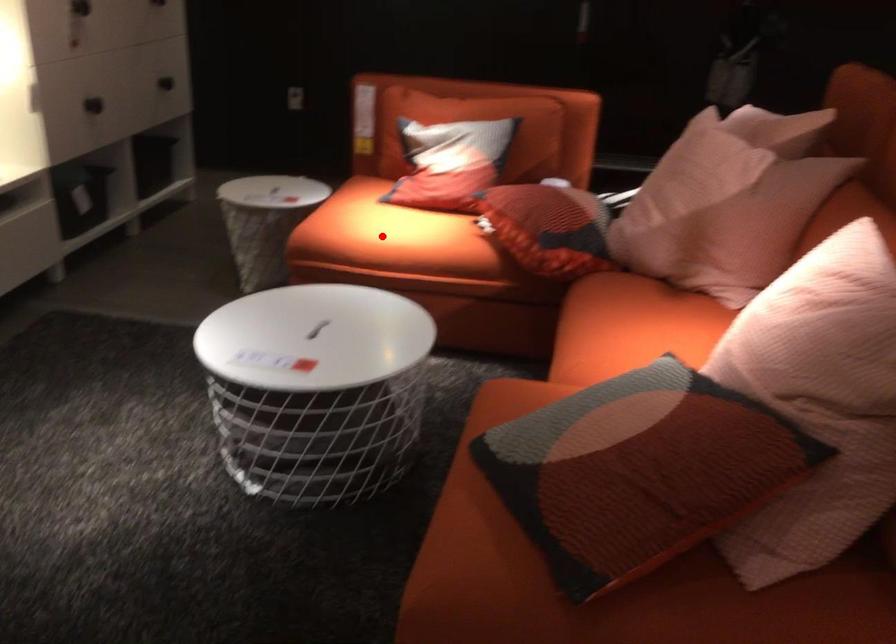
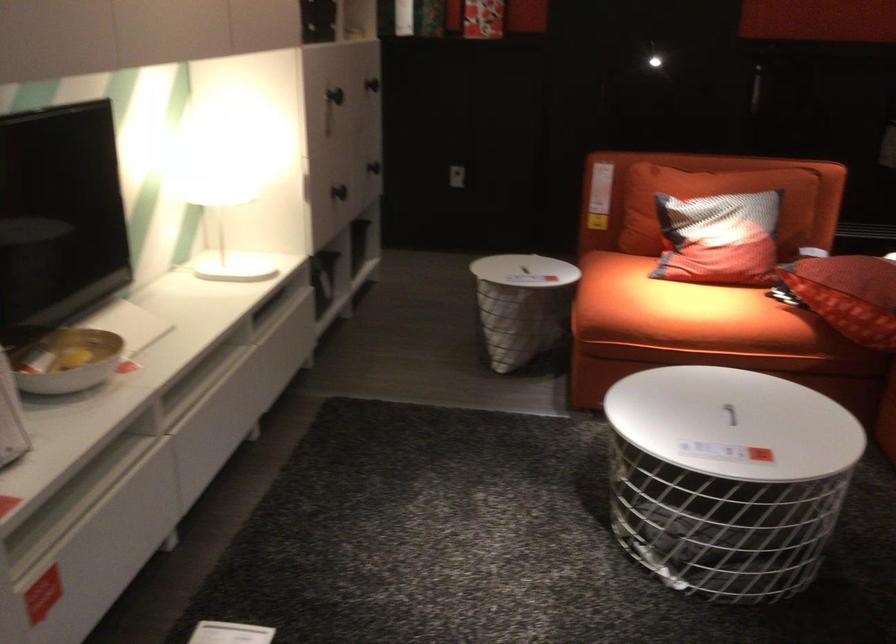
Find the pixel in the second image that matches the highlighted location in the first image.

(684, 312)